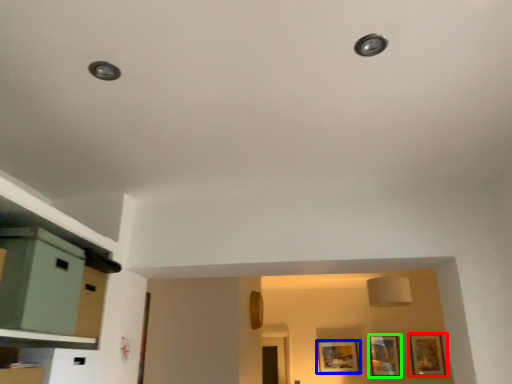
Question: Which is nearer to the picture frame (highlighted by a red box)? picture frame (highlighted by a blue box) or picture frame (highlighted by a green box).

Choices:
 (A) picture frame
 (B) picture frame

Answer: (B)